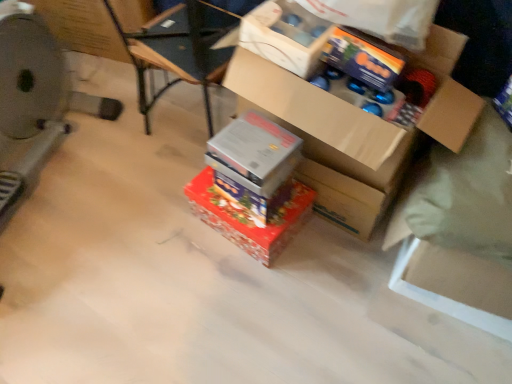
The height and width of the screenshot is (384, 512). In order to click on vacant area situated below metallic silver exercise machine at left (from a real-world perspective) in this screenshot , I will do click(53, 179).